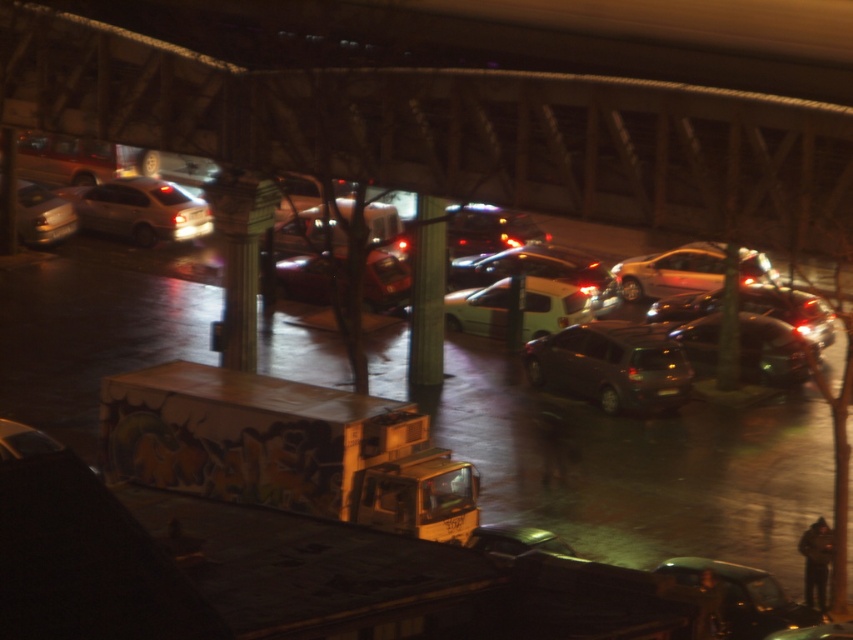
Is satin brown hatchback at center taller than shiny metallic car at center?

Yes, satin brown hatchback at center is taller than shiny metallic car at center.

Does satin brown hatchback at center have a larger size compared to shiny metallic car at center?

Correct, satin brown hatchback at center is larger in size than shiny metallic car at center.

Who is more forward, (x=605, y=321) or (x=780, y=328)?

Point (x=605, y=321) is more forward.

This screenshot has height=640, width=853. Find the location of `satin brown hatchback at center`. satin brown hatchback at center is located at coordinates (611, 365).

Is point (798, 308) farther from viewer compared to point (16, 202)?

No, it is in front of (16, 202).

Is point (740, 298) closer to camera compared to point (59, 232)?

Yes.

Who is more forward, (682,292) or (20,243)?

Point (682,292) is in front.

Where is `shiny metallic sedan at right`? This screenshot has height=640, width=853. shiny metallic sedan at right is located at coordinates coord(790,308).

Based on the photo, is shiny silver van at center taller than shiny silver car at left?

Yes.

Who is taller, shiny silver van at center or shiny silver car at left?

Standing taller between the two is shiny silver van at center.

Identify the location of shiny silver van at center. The image size is (853, 640). (300, 232).